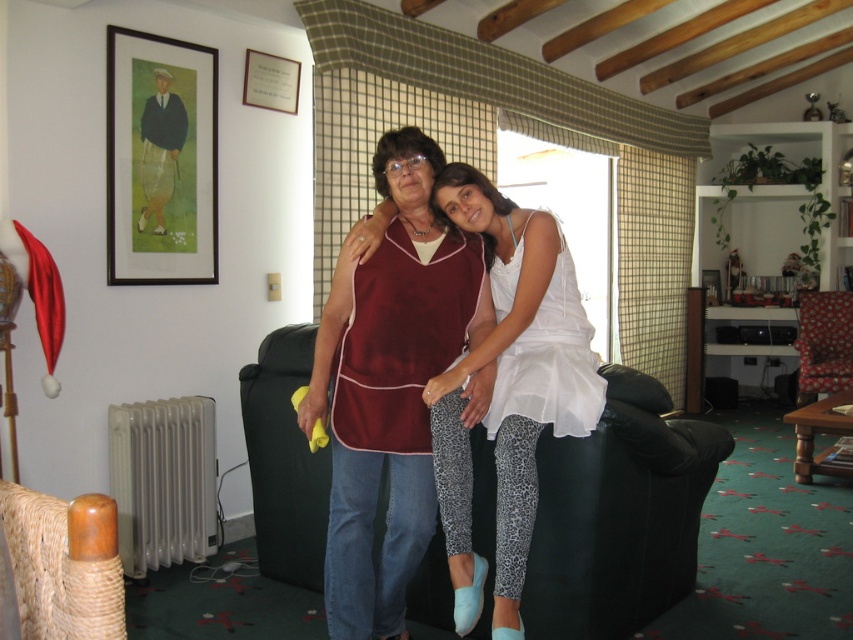
Question: Can you confirm if maroon fabric apron at center is smaller than floral fabric armchair at right?

Choices:
 (A) yes
 (B) no

Answer: (A)

Question: Which object is the closest to the floral fabric armchair at right?

Choices:
 (A) wooden framed print at upper left
 (B) black leather couch at center
 (C) woven straw armchair at lower left
 (D) velvet maroon dress at center

Answer: (B)

Question: Which of the following is the closest to the observer?

Choices:
 (A) (850, 340)
 (B) (196, 124)

Answer: (B)

Question: Which of the following is the closest to the observer?

Choices:
 (A) maroon fabric apron at center
 (B) velvet maroon dress at center

Answer: (B)

Question: Can you confirm if black leather couch at center is thinner than velvet maroon dress at center?

Choices:
 (A) yes
 (B) no

Answer: (B)

Question: Can you confirm if black leather couch at center is positioned above wooden framed print at upper left?

Choices:
 (A) yes
 (B) no

Answer: (B)